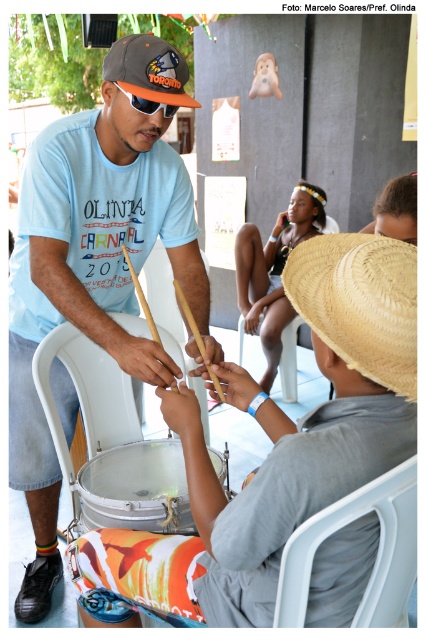
Is natural straw hat at center shorter than silver metallic drum at lower center?

Incorrect, natural straw hat at center's height does not fall short of silver metallic drum at lower center's.

Who is more forward, (382, 300) or (186, 490)?

Point (382, 300)

Who is more distant from viewer, (414, 349) or (85, 467)?

Positioned behind is point (85, 467).

Locate an element on the screen. natural straw hat at center is located at coordinates (359, 301).

Who is lower down, matte blue t-shirt at center or natural straw hat at center?

matte blue t-shirt at center is lower down.

Is point (49, 520) behind point (359, 337)?

That is True.

I want to click on matte blue t-shirt at center, so click(x=95, y=260).

Is silver metallic drum at lower center further to camera compared to straw hat at center?

Yes, it is.

This screenshot has width=426, height=640. What do you see at coordinates (137, 488) in the screenshot?
I see `silver metallic drum at lower center` at bounding box center [137, 488].

Between point (141, 465) and point (180, 97), which one is positioned behind?

Point (141, 465)

Locate an element on the screen. Image resolution: width=426 pixels, height=640 pixels. silver metallic drum at lower center is located at coordinates (137, 488).